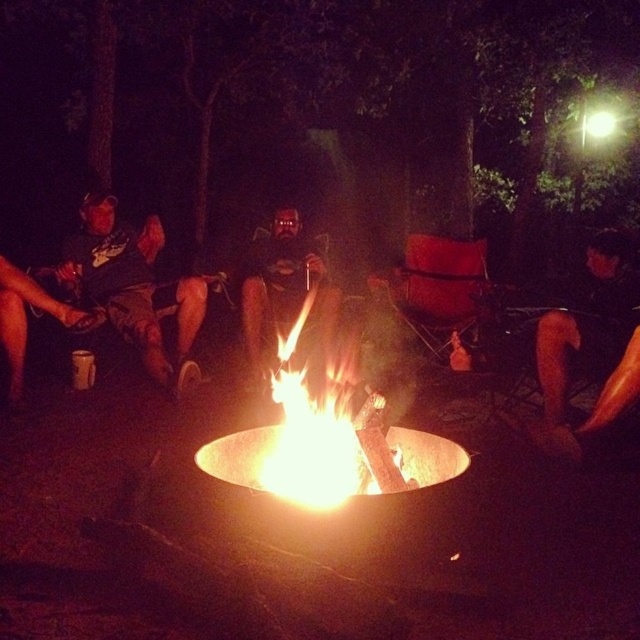
Who is higher up, matte black shirt at center or matte black mug at left?

matte black shirt at center

Consider the image. Can you confirm if matte black shirt at center is wider than matte black mug at left?

Yes.

Which is in front, point (316, 273) or point (8, 264)?

Point (8, 264) is more forward.

This screenshot has width=640, height=640. Identify the location of matte black shirt at center. [x=285, y=298].

Looking at this image, does brushed metal mug at left have a smaller size compared to matte black mug at left?

Incorrect, brushed metal mug at left is not smaller in size than matte black mug at left.

Is brushed metal mug at left to the right of matte black mug at left from the viewer's perspective?

Correct, you'll find brushed metal mug at left to the right of matte black mug at left.

Locate an element on the screen. This screenshot has height=640, width=640. brushed metal mug at left is located at coordinates (134, 288).

The height and width of the screenshot is (640, 640). Find the location of `brushed metal mug at left`. brushed metal mug at left is located at coordinates (134, 288).

Does flaming wood at center come behind matte red chair at center?

No.

Does flaming wood at center have a smaller size compared to matte red chair at center?

Indeed, flaming wood at center has a smaller size compared to matte red chair at center.

At what (x,y) coordinates should I click in order to perform the action: click on flaming wood at center. Please return your answer as a coordinate pair (x, y). Looking at the image, I should click on (324, 436).